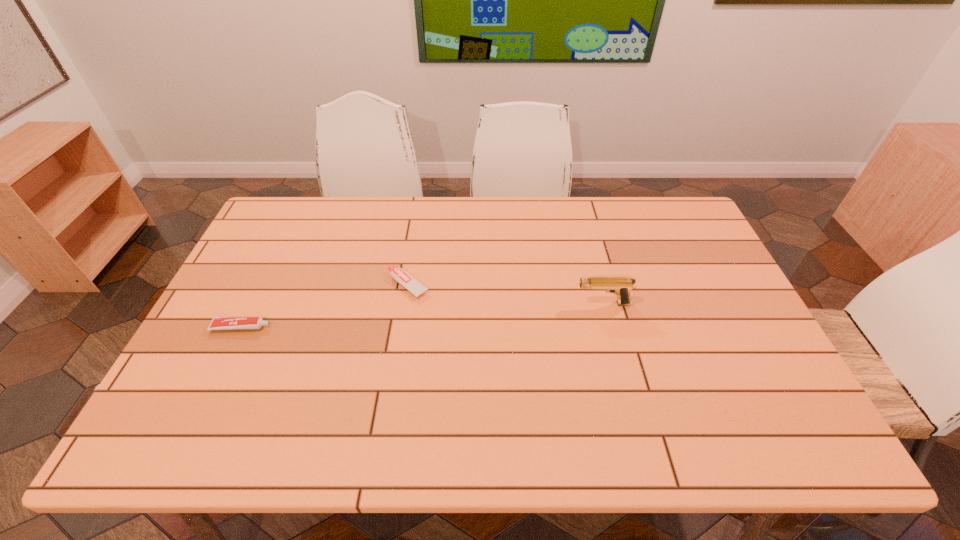
Identify the location of the rightmost object. (620, 286).

Locate an element on the screen. the tallest object is located at coordinates (620, 286).

At what (x,y) coordinates should I click in order to perform the action: click on the second object from right to left. Please return your answer as a coordinate pair (x, y). The width and height of the screenshot is (960, 540). Looking at the image, I should click on (402, 277).

Identify the location of the right toothpaste. The height and width of the screenshot is (540, 960). (402, 277).

Identify the location of the left toothpaste. The height and width of the screenshot is (540, 960). (218, 323).

Locate an element on the screen. This screenshot has width=960, height=540. the nearest object is located at coordinates (218, 323).

You are a GUI agent. You are given a task and a screenshot of the screen. Output one action in this format:
    pyautogui.click(x=<x>, y=<y>)
    Task: Click on the blank space located 0.280m at the barrel of the pistol
    Image resolution: width=960 pixels, height=540 pixels.
    Given the screenshot: What is the action you would take?
    pyautogui.click(x=477, y=303)

The width and height of the screenshot is (960, 540). I want to click on free space located 0.370m at the barrel of the pistol, so click(445, 303).

Locate an element on the screen. The width and height of the screenshot is (960, 540). vacant area located at the barrel of the pistol is located at coordinates (491, 303).

Locate an element on the screen. vacant position located 0.080m on the front of the farther toothpaste is located at coordinates (402, 323).